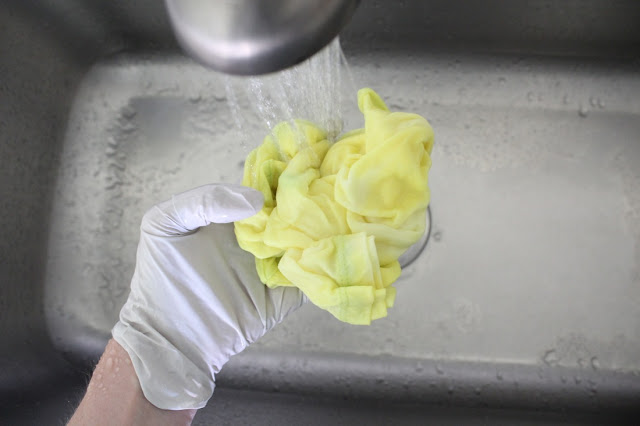
Where is `stainless steel sink`? The height and width of the screenshot is (426, 640). stainless steel sink is located at coordinates (497, 208).